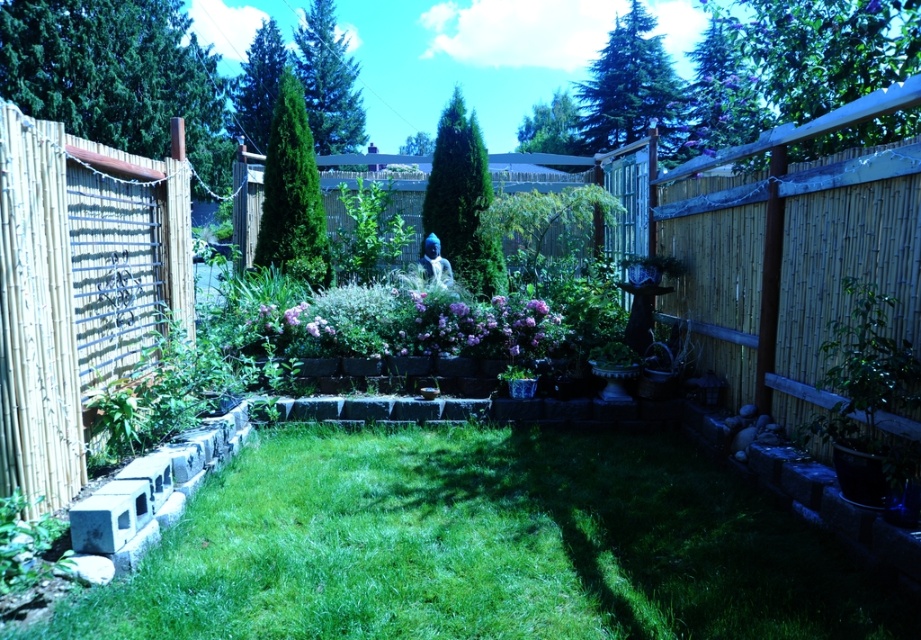
Which of these two, green grass at center or green leafy plant at lower left, stands taller?

Standing taller between the two is green grass at center.

Is green grass at center positioned before green leafy plant at lower left?

Yes, green grass at center is in front of green leafy plant at lower left.

Image resolution: width=921 pixels, height=640 pixels. Identify the location of green grass at center. (485, 547).